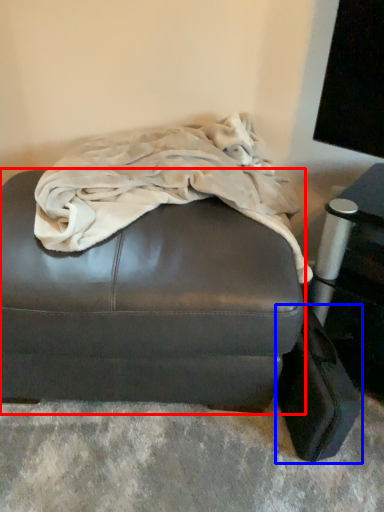
Question: Which of the following is the closest to the observer, furniture (highlighted by a red box) or luggage (highlighted by a blue box)?

Choices:
 (A) furniture
 (B) luggage

Answer: (A)